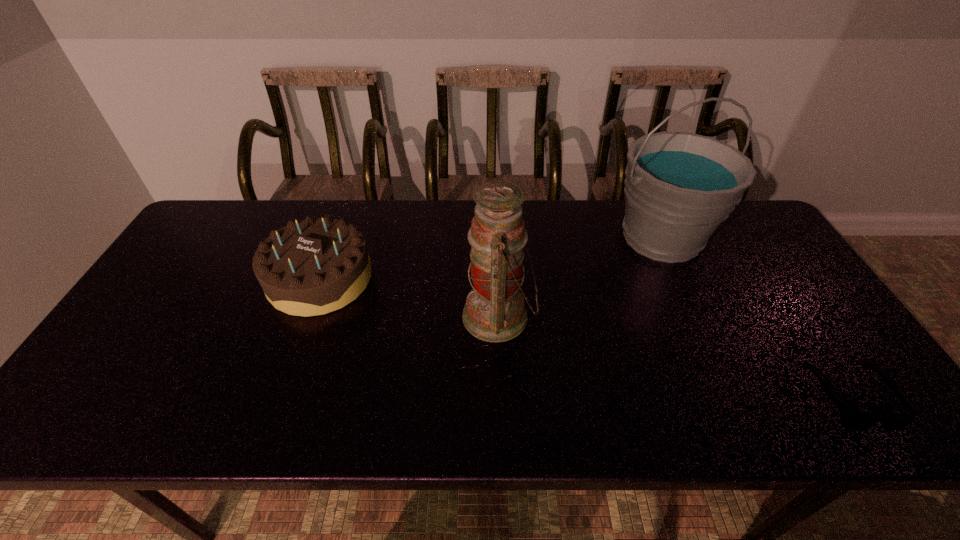
The height and width of the screenshot is (540, 960). Identify the location of birthday cake located at the far edge. (316, 266).

You are a GUI agent. You are given a task and a screenshot of the screen. Output one action in this format:
    pyautogui.click(x=<x>, y=<y>)
    Task: Click on the object present at the near edge
    
    Given the screenshot: What is the action you would take?
    point(855,421)

Identify the location of object that is at the right edge. This screenshot has width=960, height=540. (855, 421).

At what (x,y) coordinates should I click in order to perform the action: click on object that is at the near right corner. Please return your answer as a coordinate pair (x, y). The width and height of the screenshot is (960, 540). Looking at the image, I should click on click(855, 421).

This screenshot has width=960, height=540. Find the location of `free region at the far edge`. free region at the far edge is located at coordinates (537, 245).

This screenshot has height=540, width=960. In order to click on vacant space at the near edge in this screenshot , I will do `click(791, 425)`.

I want to click on vacant space at the left edge, so coord(156,318).

In the image, there is a desktop. In order to click on vacant space at the right edge in this screenshot , I will do `click(836, 377)`.

Identify the location of vacant region at the far left corner of the desktop. (205, 233).

The height and width of the screenshot is (540, 960). What are the coordinates of `free space at the near left corner of the desktop` in the screenshot? It's located at (74, 407).